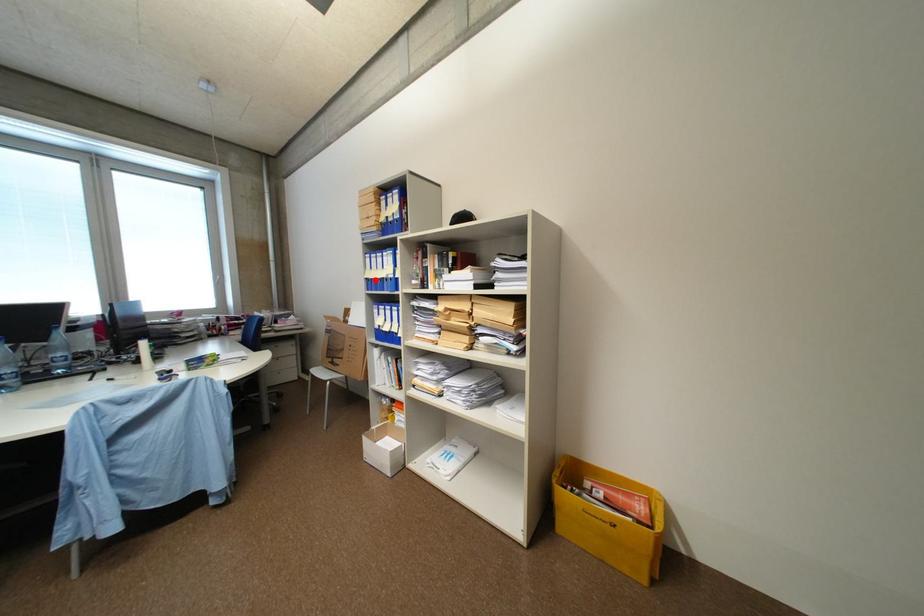
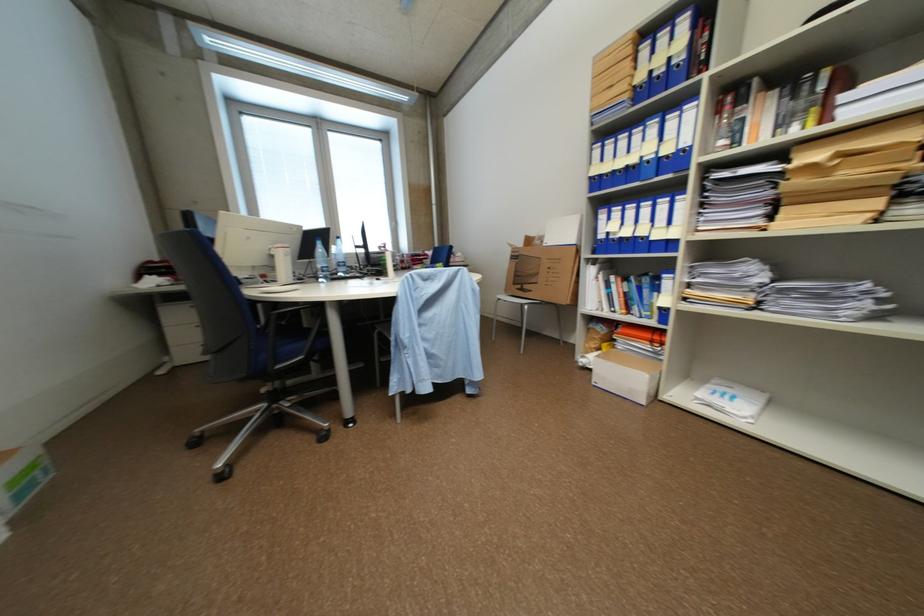
In the second image, find the point that corresponds to the highlighted location in the first image.

(600, 180)